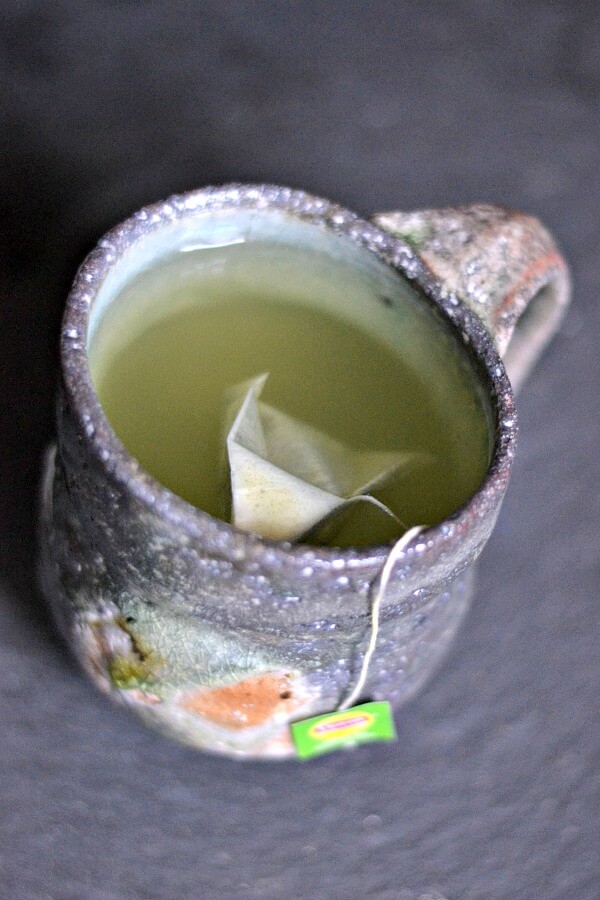
The image size is (600, 900). In order to click on space to bottom of mug in this screenshot , I will do `click(281, 774)`.